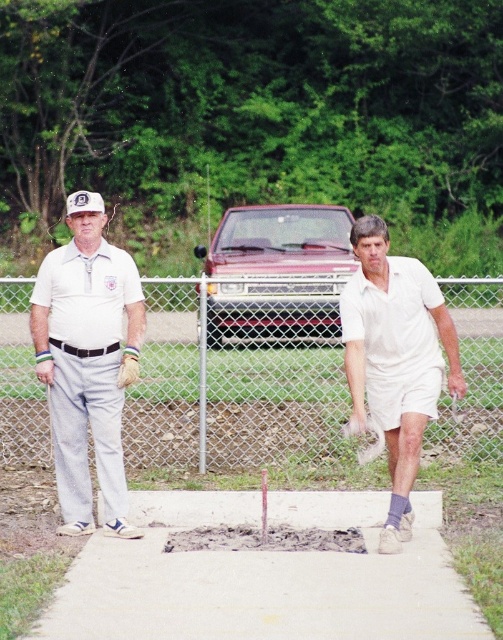
Based on the photo, can you confirm if metal chain-link fence at center is positioned to the left of white cotton shirt at center?

Indeed, metal chain-link fence at center is positioned on the left side of white cotton shirt at center.

Who is positioned more to the right, metal chain-link fence at center or white cotton shirt at center?

white cotton shirt at center

Image resolution: width=503 pixels, height=640 pixels. In order to click on metal chain-link fence at center in this screenshot , I will do `click(236, 380)`.

What do you see at coordinates (236, 380) in the screenshot? I see `metal chain-link fence at center` at bounding box center [236, 380].

Which is below, metal chain-link fence at center or gray concrete hole at center?

gray concrete hole at center is lower down.

Measure the distance between point [4,310] and camera.

Point [4,310] and camera are 30.21 feet apart from each other.

You are a GUI agent. You are given a task and a screenshot of the screen. Output one action in this format:
    pyautogui.click(x=<x>, y=<y>)
    Task: Click on the metal chain-link fence at center
    
    Given the screenshot: What is the action you would take?
    pyautogui.click(x=236, y=380)

Can you confirm if metal chain-link fence at center is positioned above white cotton shirt at left?

Correct, metal chain-link fence at center is located above white cotton shirt at left.

Does point (278, 400) lie in front of point (62, 372)?

No, (278, 400) is behind (62, 372).

In the scene shown: Who is more forward, (16, 298) or (66, 474)?

Point (66, 474) is in front.

Identify the location of metal chain-link fence at center. This screenshot has height=640, width=503. (236, 380).